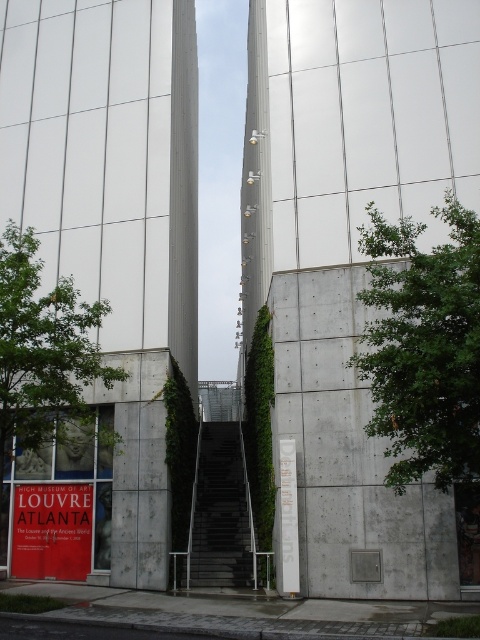
Who is more distant from viewer, (21, 131) or (17, 525)?

Point (21, 131)

Is point (147, 364) behind point (48, 506)?

No, (147, 364) is in front of (48, 506).

What are the coordinates of `white concrete tower at center` in the screenshot? It's located at (113, 216).

Does white concrete tower at center appear under smooth concrete tower at center?

Yes, white concrete tower at center is below smooth concrete tower at center.

Is white concrete tower at center further to camera compared to smooth concrete tower at center?

No, white concrete tower at center is closer to the viewer.

What are the coordinates of `white concrete tower at center` in the screenshot? It's located at (113, 216).

This screenshot has width=480, height=640. I want to click on white concrete tower at center, so click(113, 216).

Between white concrete tower at center and gray concrete wall at center, which one has more height?

With more height is white concrete tower at center.

How far apart are white concrete tower at center and gray concrete wall at center?

3.82 meters

Find the location of a particular element. This screenshot has width=480, height=640. white concrete tower at center is located at coordinates (113, 216).

The height and width of the screenshot is (640, 480). What are the coordinates of `white concrete tower at center` in the screenshot? It's located at (113, 216).